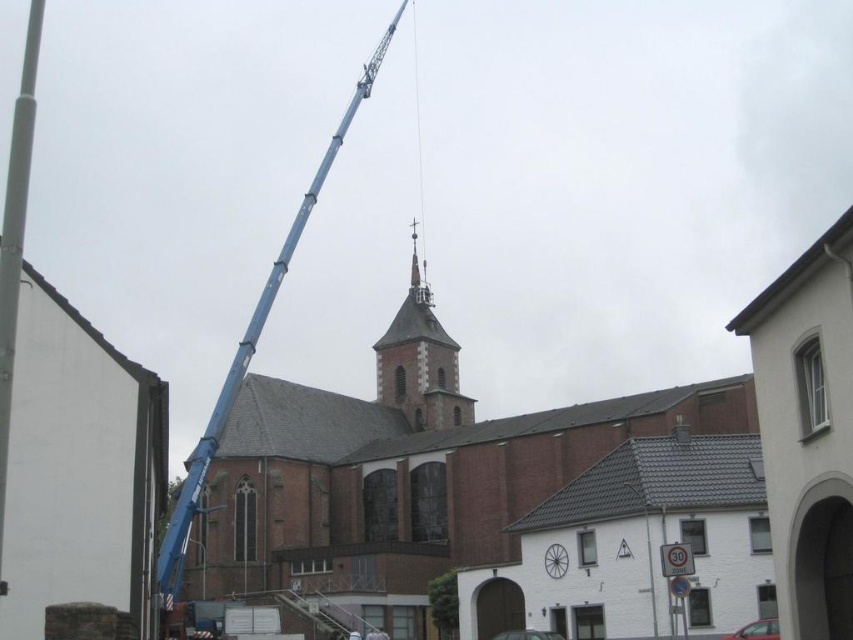
You are a construction worker assessing the space between the blue metallic crane at upper left and the smooth white pole at left. Can you fit a 1.5 meter wide equipment container between them?

The blue metallic crane at upper left is thinner than the smooth white pole at left, so the space between them may be sufficient to fit the 1.5 meter wide equipment container. However, exact dimensions are needed for precise confirmation.

You are a construction worker standing at the center of the scene. You need to lift a heavy object using the blue metallic crane at upper left. However, there is a smooth brown leather belt at center in the way. Can the crane safely move the object over the belt without touching it?

The blue metallic crane at upper left is located above the smooth brown leather belt at center, so it can safely move the object over the belt without touching it.

You are a city planner analyzing the urban layout. Given the scene, which of the two structures, the brick church at center or the smooth stone tower at center, occupies more visual space in the image?

The brick church at center is larger in size than the smooth stone tower at center, so it occupies more visual space in the image.